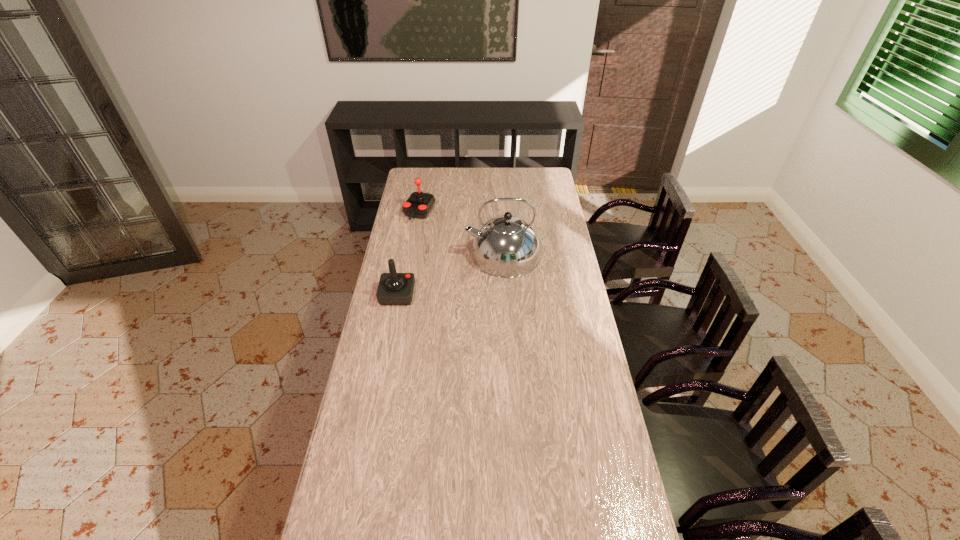
Locate an element on the screen. object that stands as the closest to the nearest object is located at coordinates (x=506, y=246).

This screenshot has width=960, height=540. What are the coordinates of `joystick that stands as the second closest to the second farthest object` in the screenshot? It's located at (394, 288).